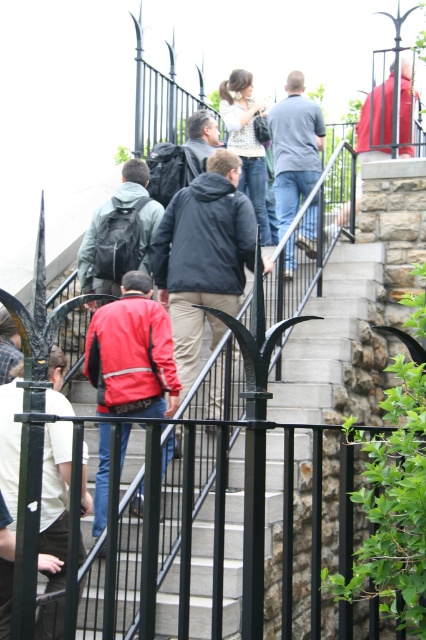
You are part of the group ascending the stone stairs and want to reach the top. You notice the patterned blouse at center and the matte black backpack at center. Which object is closer to you as you climb?

The patterned blouse at center is closer to you because the matte black backpack at center is behind it.

You are standing at the bottom of the stone stairs and want to reach the top. There are two points marked on the stairs, point A at coordinates point A is point (x=227, y=305) and point B at point (x=334, y=216). Which point is closer to the top of the stairs?

Point B at point (x=334, y=216) is closer to the top of the stairs because it is behind point A at point (x=227, y=305), which is in front of it.